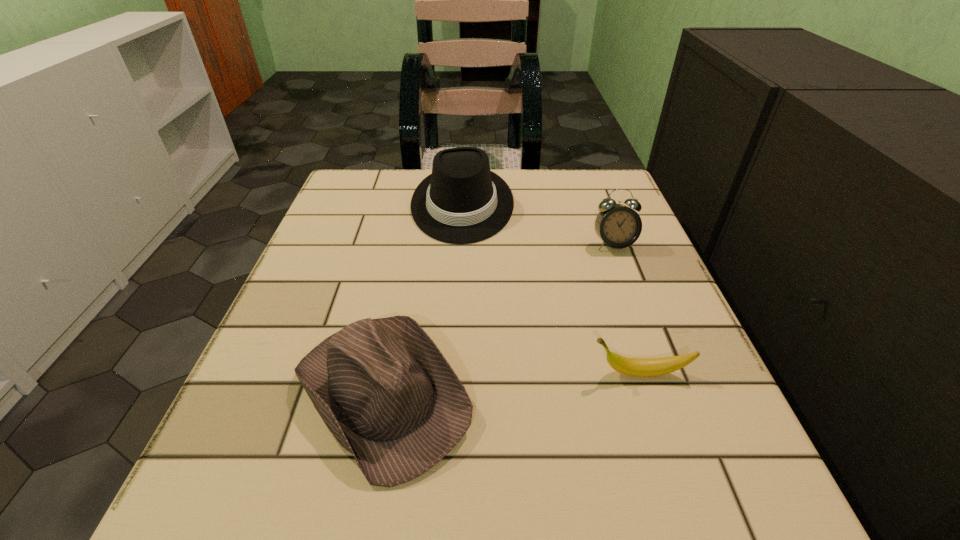
Locate an element on the screen. Image resolution: width=960 pixels, height=540 pixels. object present at the far edge is located at coordinates (462, 201).

Locate an element on the screen. The height and width of the screenshot is (540, 960). object that is at the near edge is located at coordinates (383, 388).

Find the location of `object that is at the left edge`. object that is at the left edge is located at coordinates (383, 388).

Locate an element on the screen. This screenshot has width=960, height=540. alarm clock that is at the right edge is located at coordinates (618, 226).

This screenshot has height=540, width=960. What are the coordinates of `banana at the right edge` in the screenshot? It's located at (641, 367).

I want to click on object that is at the near left corner, so click(x=383, y=388).

You are a GUI agent. You are given a task and a screenshot of the screen. Output one action in this format:
    pyautogui.click(x=<x>, y=<y>)
    Task: Click on the vacant space at the far edge of the desktop
    
    Given the screenshot: What is the action you would take?
    pyautogui.click(x=538, y=168)

At what (x,y) coordinates should I click in order to perform the action: click on vacant space at the left edge. Please return your answer as a coordinate pair (x, y). The height and width of the screenshot is (540, 960). Looking at the image, I should click on (231, 434).

Find the location of a particular element. The height and width of the screenshot is (540, 960). vacant space at the right edge of the desktop is located at coordinates (629, 283).

Identify the location of vacant space at the far left corner. This screenshot has width=960, height=540. (353, 169).